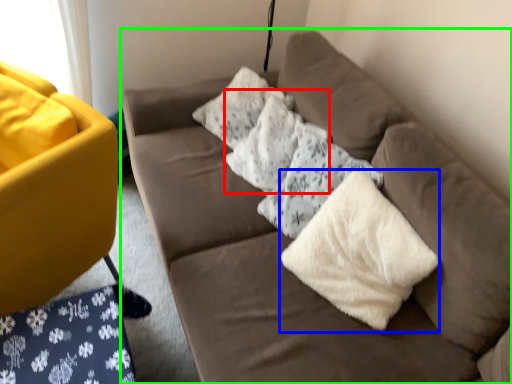
Question: Considering the real-world distances, which object is farthest from pillow (highlighted by a red box)? material (highlighted by a blue box) or studio couch (highlighted by a green box)?

Choices:
 (A) material
 (B) studio couch

Answer: (A)